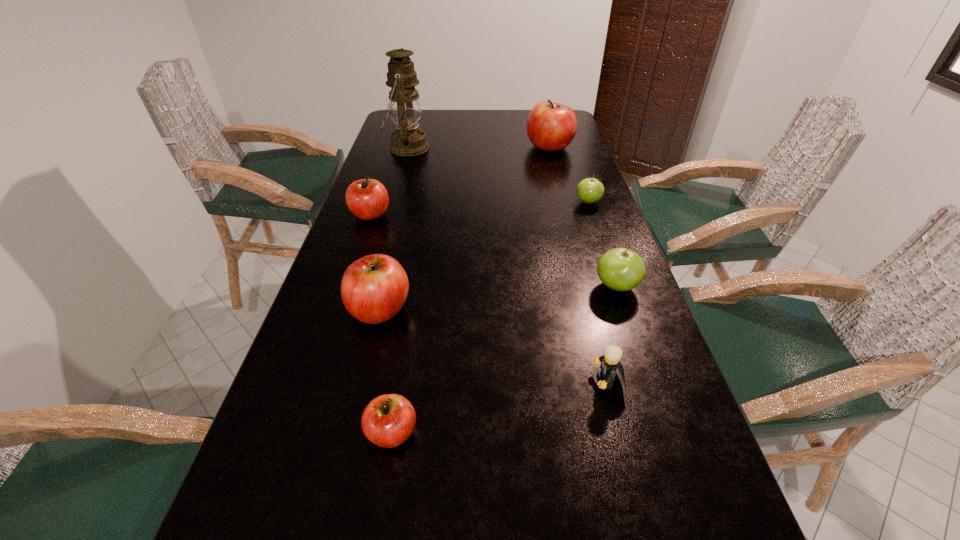
Find the location of a particular element. the tallest object is located at coordinates (404, 102).

Find the location of a particular element. green oil lamp is located at coordinates (404, 102).

At what (x,y) coordinates should I click in order to perform the action: click on the farthest apple. Please return your answer as a coordinate pair (x, y). This screenshot has height=540, width=960. Looking at the image, I should click on click(551, 126).

I want to click on the rightmost red apple, so click(x=551, y=126).

I want to click on the second tallest apple, so click(x=374, y=288).

Find the location of a particular element. the third smallest red apple is located at coordinates click(374, 288).

The image size is (960, 540). I want to click on the nearer green apple, so click(x=620, y=269).

The height and width of the screenshot is (540, 960). What are the coordinates of `the second farthest red apple` in the screenshot? It's located at pos(367,199).

Identify the location of the seventh farthest object. This screenshot has height=540, width=960. (610, 361).

At what (x,y) coordinates should I click in order to perform the action: click on the farther green apple. Please return your answer as a coordinate pair (x, y). This screenshot has height=540, width=960. Looking at the image, I should click on (590, 190).